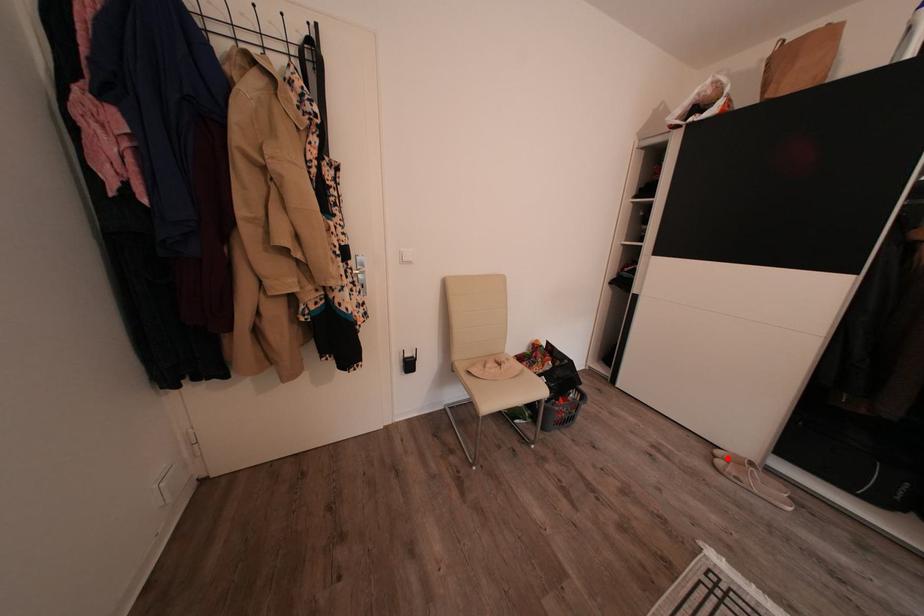
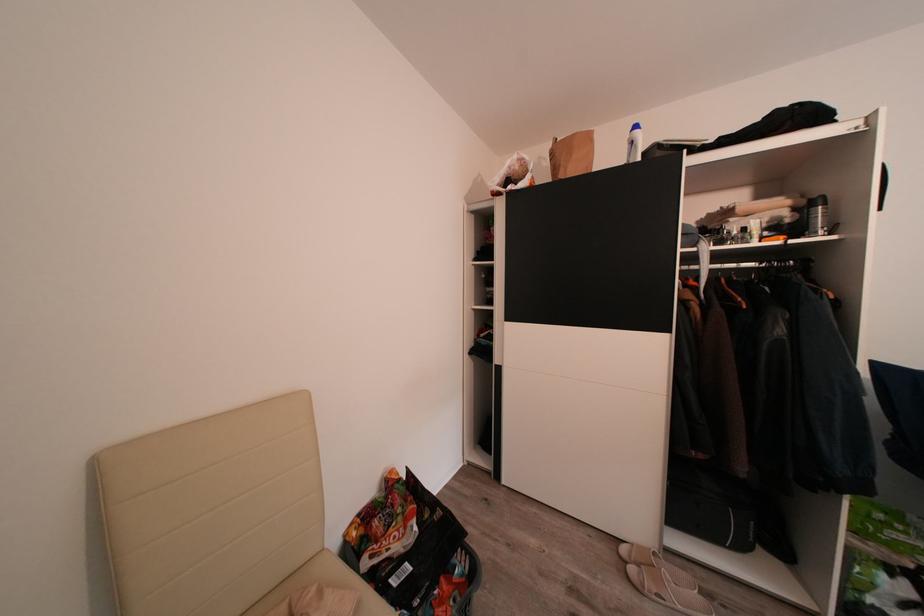
Locate, in the second image, the point that corresponds to the highlighted location in the first image.

(631, 554)